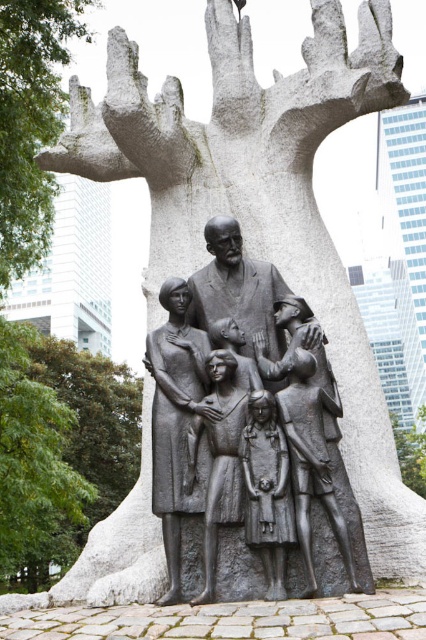
Is gray stone tree trunk at upper center to the left of bronze sculpture of family at center from the viewer's perspective?

Correct, you'll find gray stone tree trunk at upper center to the left of bronze sculpture of family at center.

Which is more to the right, gray stone tree trunk at upper center or bronze sculpture of family at center?

Positioned to the right is bronze sculpture of family at center.

What do you see at coordinates (31, 122) in the screenshot? The image size is (426, 640). I see `gray stone tree trunk at upper center` at bounding box center [31, 122].

Where is `gray stone tree trunk at upper center`? This screenshot has height=640, width=426. gray stone tree trunk at upper center is located at coordinates (31, 122).

Does green leafy tree at lower left have a larger size compared to bronze sculpture of family at center?

Correct, green leafy tree at lower left is larger in size than bronze sculpture of family at center.

Which is more to the right, green leafy tree at lower left or bronze sculpture of family at center?

Positioned to the right is bronze sculpture of family at center.

You are a GUI agent. You are given a task and a screenshot of the screen. Output one action in this format:
    pyautogui.click(x=<x>, y=<y>)
    Task: Click on the green leafy tree at lower left
    The image size is (426, 640).
    Given the screenshot: What is the action you would take?
    pyautogui.click(x=34, y=460)

Which of these two, green leafy tree at lower left or gray stone tree trunk at center, stands taller?

green leafy tree at lower left is taller.

Can you confirm if green leafy tree at lower left is positioned above gray stone tree trunk at center?

Correct, green leafy tree at lower left is located above gray stone tree trunk at center.

Who is more forward, (36, 426) or (420, 490)?

Positioned in front is point (36, 426).

The width and height of the screenshot is (426, 640). I want to click on green leafy tree at lower left, so click(x=34, y=460).